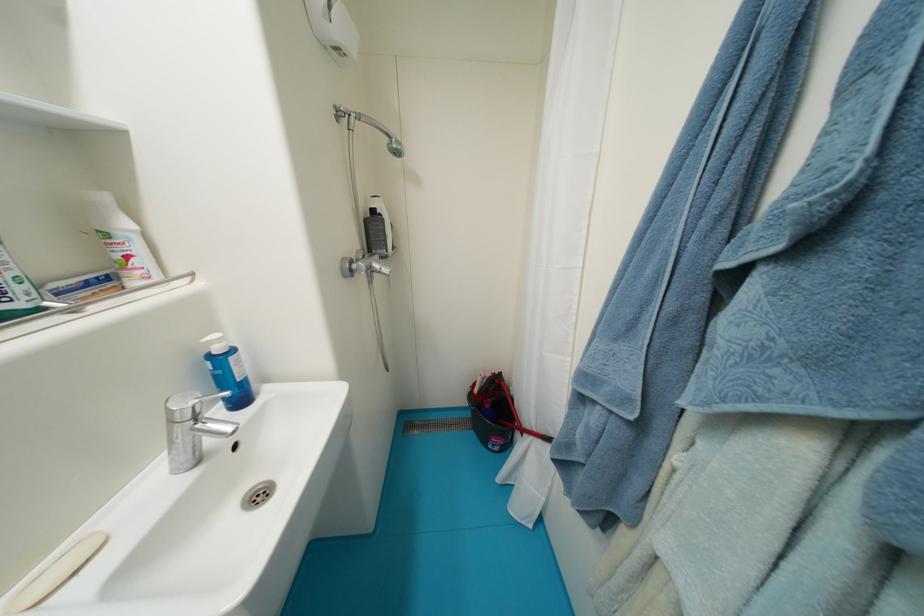
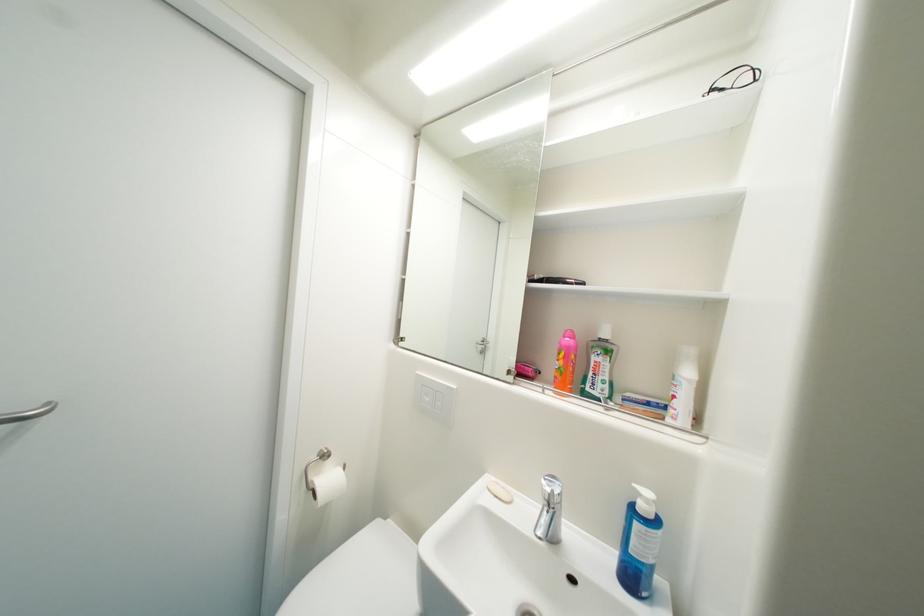
Find the pixel in the second image that matches (x=225, y=342) in the first image.

(653, 503)